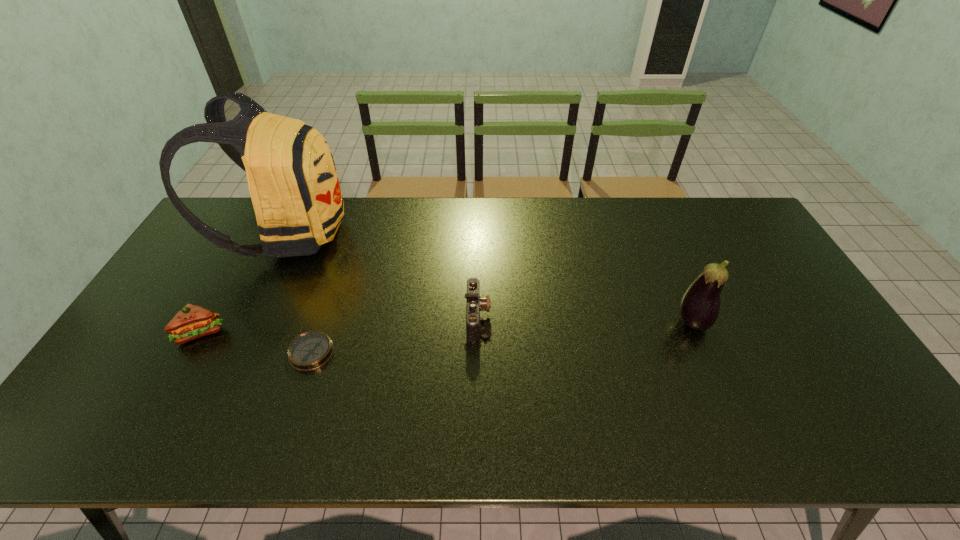
Find the location of a particular element. free space between the shortest object and the tallest object is located at coordinates (300, 293).

What are the coordinates of `object that is the second closest to the compass` in the screenshot? It's located at (293, 183).

Find the location of a particular element. The height and width of the screenshot is (540, 960). the fourth closest object to the camera is located at coordinates (192, 321).

What are the coordinates of `vacant point that satisfies the following two spatial constraints: 1. on the back side of the shortest object; 2. on the right side of the eggplant` in the screenshot? It's located at (322, 322).

The height and width of the screenshot is (540, 960). What are the coordinates of `free space that satisfies the following two spatial constraints: 1. on the front-facing side of the compass; 2. on the right side of the farthest object` in the screenshot? It's located at (232, 353).

The height and width of the screenshot is (540, 960). Identify the location of vacant point that satisfies the following two spatial constraints: 1. on the front-facing side of the second shortest object; 2. on the back side of the fourth shortest object. (478, 322).

This screenshot has height=540, width=960. Identify the location of free space that satisfies the following two spatial constraints: 1. on the front-facing side of the tallest object; 2. on the front side of the sandwich. (242, 333).

Locate an element on the screen. blank area in the image that satisfies the following two spatial constraints: 1. on the back side of the compass; 2. on the right side of the eggplant is located at coordinates (322, 322).